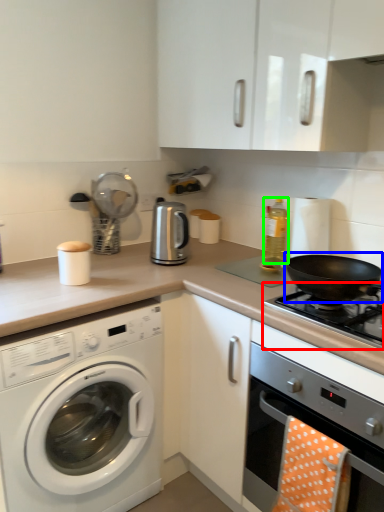
Question: Which is farther away from gas stove (highlighted by a red box)? wok (highlighted by a blue box) or bottle (highlighted by a green box)?

Choices:
 (A) wok
 (B) bottle

Answer: (B)